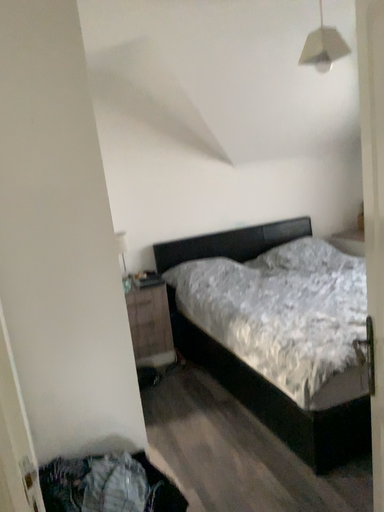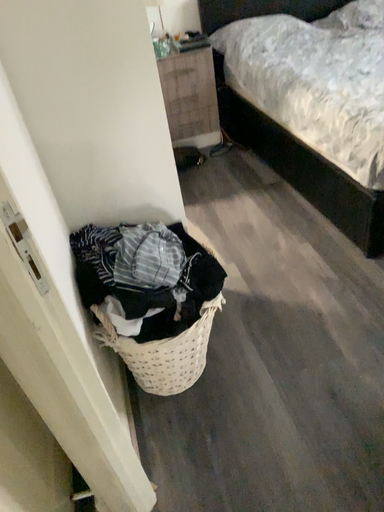
Question: Which way did the camera rotate in the video?

Choices:
 (A) rotated right
 (B) rotated left

Answer: (B)